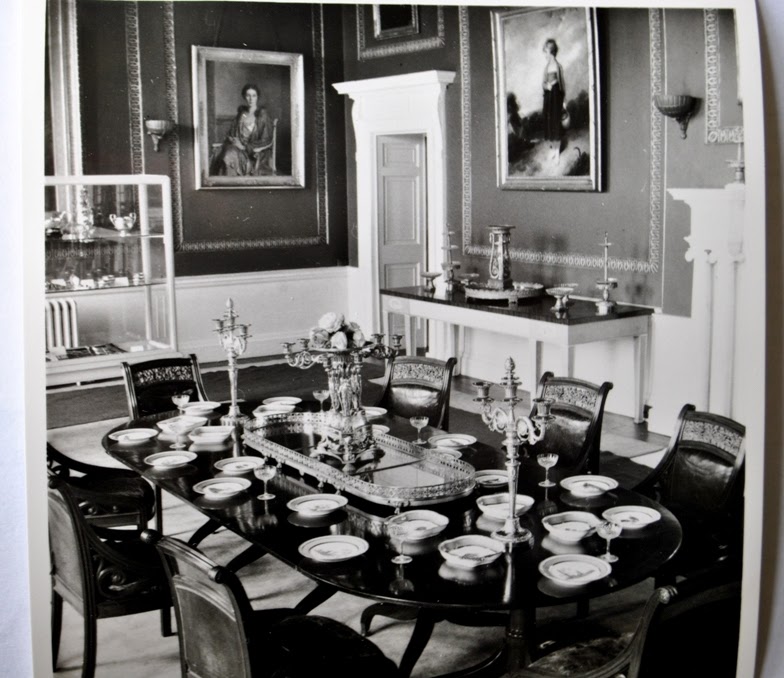
Where is `table`? table is located at coordinates (521, 578), (579, 335).